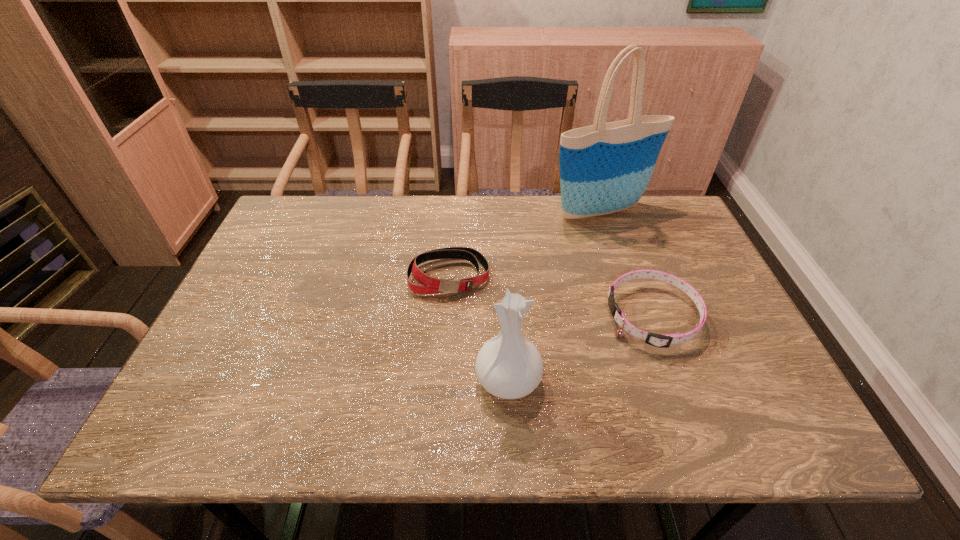
Find the location of a particular element. This screenshot has width=960, height=540. the tallest object is located at coordinates (605, 168).

In order to click on the farthest object in this screenshot , I will do `click(605, 168)`.

The width and height of the screenshot is (960, 540). In order to click on the second tallest object in this screenshot , I will do `click(509, 366)`.

Where is `the left dog collar`? the left dog collar is located at coordinates (429, 285).

I want to click on the shorter dog collar, so click(x=662, y=341).

At what (x,y) coordinates should I click in order to perform the action: click on the shortest object. Please return your answer as a coordinate pair (x, y). The image size is (960, 540). Looking at the image, I should click on (662, 341).

Where is `vacant space positioned 0.270m on the left of the tote bag`? The image size is (960, 540). vacant space positioned 0.270m on the left of the tote bag is located at coordinates (462, 212).

Identify the location of free space located on the right of the vase. This screenshot has width=960, height=540. (569, 379).

The image size is (960, 540). What are the coordinates of `vacant space situated 0.300m on the back of the left dog collar` in the screenshot? It's located at (455, 196).

Where is `vacant region located with the buckle on the shorter dog collar`? The image size is (960, 540). vacant region located with the buckle on the shorter dog collar is located at coordinates (517, 316).